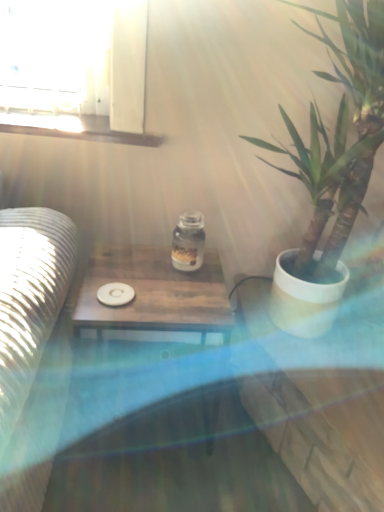
The width and height of the screenshot is (384, 512). Identify the location of vacant space in green leafy plant in white pot at right (from a real-world perspective). (294, 335).